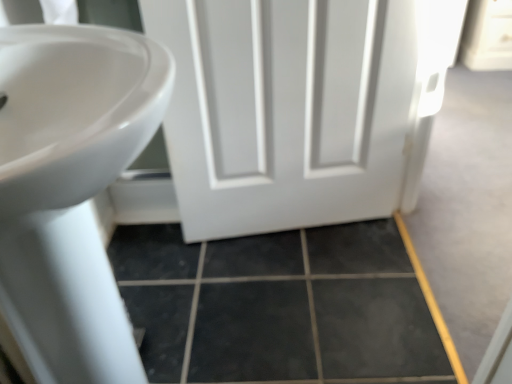
Question: Is the depth of white matte door at center less than that of dark gray tile at lower center?

Choices:
 (A) no
 (B) yes

Answer: (B)

Question: Is white matte door at center positioned behind dark gray tile at lower center?

Choices:
 (A) no
 (B) yes

Answer: (A)

Question: Are white matte door at center and dark gray tile at lower center beside each other?

Choices:
 (A) no
 (B) yes

Answer: (A)

Question: Is white matte door at center facing towards dark gray tile at lower center?

Choices:
 (A) no
 (B) yes

Answer: (B)

Question: Is white matte door at center surrounding dark gray tile at lower center?

Choices:
 (A) no
 (B) yes

Answer: (A)

Question: Can we say white matte door at center lies outside dark gray tile at lower center?

Choices:
 (A) no
 (B) yes

Answer: (B)

Question: From a real-world perspective, is dark gray tile at lower center over white glossy sink at left?

Choices:
 (A) no
 (B) yes

Answer: (A)

Question: Is dark gray tile at lower center completely or partially outside of white glossy sink at left?

Choices:
 (A) no
 (B) yes

Answer: (B)

Question: From a real-world perspective, is dark gray tile at lower center under white glossy sink at left?

Choices:
 (A) no
 (B) yes

Answer: (B)

Question: Is dark gray tile at lower center at the left side of white glossy sink at left?

Choices:
 (A) yes
 (B) no

Answer: (B)

Question: Is the depth of dark gray tile at lower center less than that of white glossy sink at left?

Choices:
 (A) no
 (B) yes

Answer: (A)

Question: Can you confirm if dark gray tile at lower center is positioned to the right of white glossy sink at left?

Choices:
 (A) no
 (B) yes

Answer: (B)

Question: Is white glossy sink at left further to the viewer compared to white matte door at center?

Choices:
 (A) yes
 (B) no

Answer: (B)